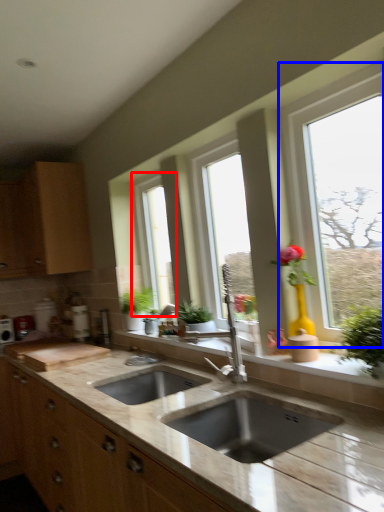
Question: Which object is further to the camera taking this photo, window (highlighted by a red box) or window (highlighted by a blue box)?

Choices:
 (A) window
 (B) window

Answer: (A)